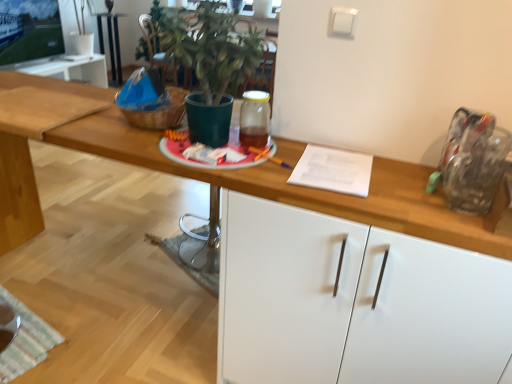
Question: Is metallic silver table at center facing away from white glossy cabinet at center?

Choices:
 (A) yes
 (B) no

Answer: (B)

Question: Can you confirm if metallic silver table at center is taller than white glossy cabinet at center?

Choices:
 (A) yes
 (B) no

Answer: (B)

Question: From the image's perspective, does metallic silver table at center appear lower than white glossy cabinet at center?

Choices:
 (A) no
 (B) yes

Answer: (A)

Question: Considering the relative sizes of metallic silver table at center and white glossy cabinet at center in the image provided, is metallic silver table at center smaller than white glossy cabinet at center?

Choices:
 (A) no
 (B) yes

Answer: (B)

Question: Is white glossy cabinet at center located within metallic silver table at center?

Choices:
 (A) no
 (B) yes

Answer: (A)

Question: Does metallic silver table at center have a lesser width compared to white glossy cabinet at center?

Choices:
 (A) yes
 (B) no

Answer: (A)

Question: Does green matte plant pot at center have a lesser height compared to metallic silver table at center?

Choices:
 (A) no
 (B) yes

Answer: (B)

Question: Is green matte plant pot at center completely or partially outside of metallic silver table at center?

Choices:
 (A) no
 (B) yes

Answer: (B)

Question: Considering the relative sizes of green matte plant pot at center and metallic silver table at center in the image provided, is green matte plant pot at center thinner than metallic silver table at center?

Choices:
 (A) no
 (B) yes

Answer: (A)

Question: Is green matte plant pot at center at the right side of metallic silver table at center?

Choices:
 (A) yes
 (B) no

Answer: (A)

Question: Is green matte plant pot at center facing towards metallic silver table at center?

Choices:
 (A) yes
 (B) no

Answer: (B)

Question: Is green matte plant pot at center positioned with its back to metallic silver table at center?

Choices:
 (A) yes
 (B) no

Answer: (B)

Question: Is green matte plant pot at center positioned with its back to white glossy cabinet at center?

Choices:
 (A) yes
 (B) no

Answer: (B)